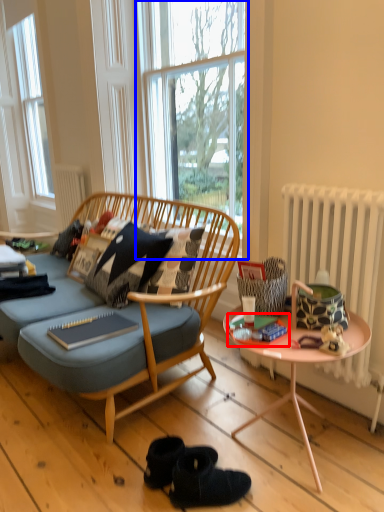
Question: Which of the following is the closest to the observer, magazine (highlighted by a red box) or window (highlighted by a blue box)?

Choices:
 (A) magazine
 (B) window

Answer: (A)